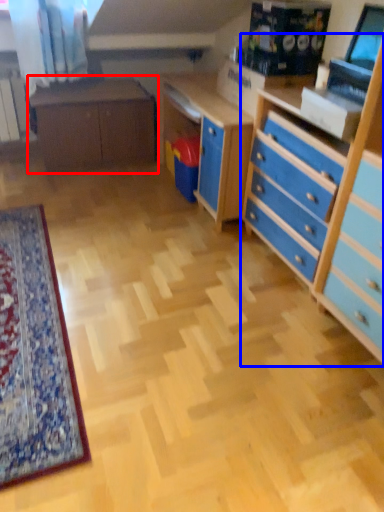
Question: Among these objects, which one is farthest to the camera, table (highlighted by a red box) or chest of drawers (highlighted by a blue box)?

Choices:
 (A) table
 (B) chest of drawers

Answer: (A)